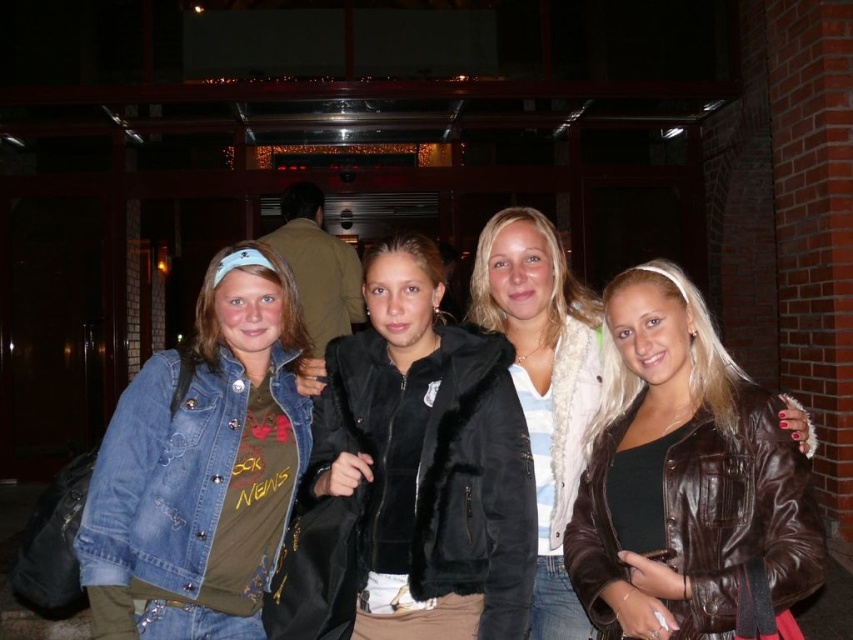
Question: Can you confirm if denim jacket at lower left is positioned above white fur coat at center?

Choices:
 (A) yes
 (B) no

Answer: (B)

Question: Which of these objects is positioned farthest from the brown leather jacket at right?

Choices:
 (A) denim jacket at lower left
 (B) white fur coat at center

Answer: (A)

Question: Which point appears farthest from the camera in this image?

Choices:
 (A) (694, 387)
 (B) (96, 481)
 (C) (563, 518)
 (D) (440, 499)

Answer: (C)

Question: Is black fur jacket at center positioned before brown leather jacket at right?

Choices:
 (A) yes
 (B) no

Answer: (B)

Question: Which point appears closest to the camera in this image?

Choices:
 (A) (537, 605)
 (B) (236, 364)
 (C) (447, 451)
 (D) (637, 592)

Answer: (D)

Question: Can you confirm if black fur jacket at center is thinner than white fur coat at center?

Choices:
 (A) no
 (B) yes

Answer: (A)